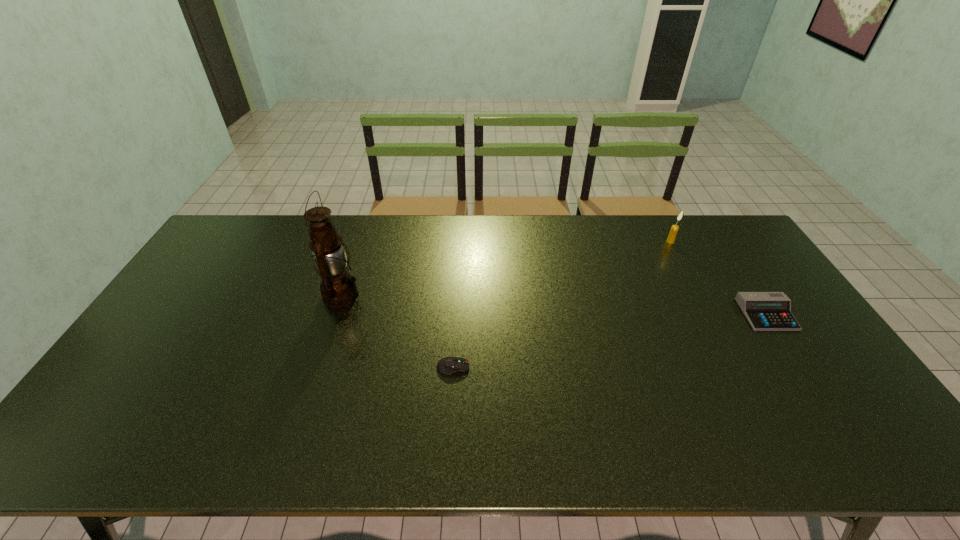
Find the location of `free space between the second tallest object and the leftmost object`. free space between the second tallest object and the leftmost object is located at coordinates (506, 268).

Identify the location of free space between the nearest object and the third object from left to right. This screenshot has height=540, width=960. (562, 305).

The height and width of the screenshot is (540, 960). I want to click on vacant point located between the candle and the shortest object, so click(562, 305).

The height and width of the screenshot is (540, 960). What are the coordinates of `vacant area that lies between the candle and the tallest object` in the screenshot? It's located at (506, 268).

Image resolution: width=960 pixels, height=540 pixels. Identify the location of free spot between the leftmost object and the third object from right to left. tap(397, 331).

Where is `vacant space in between the third object from right to left and the second object from right to left`? vacant space in between the third object from right to left and the second object from right to left is located at coordinates (562, 305).

Identify the location of empty space between the computer equipment and the second tallest object. (562, 305).

Locate an element on the screen. free spot between the calculator and the third object from right to left is located at coordinates (610, 341).

In order to click on vacant region between the third object from left to right and the leftmost object in this screenshot , I will do `click(506, 268)`.

In order to click on object that is the third nearest to the third tallest object in this screenshot , I will do `click(338, 288)`.